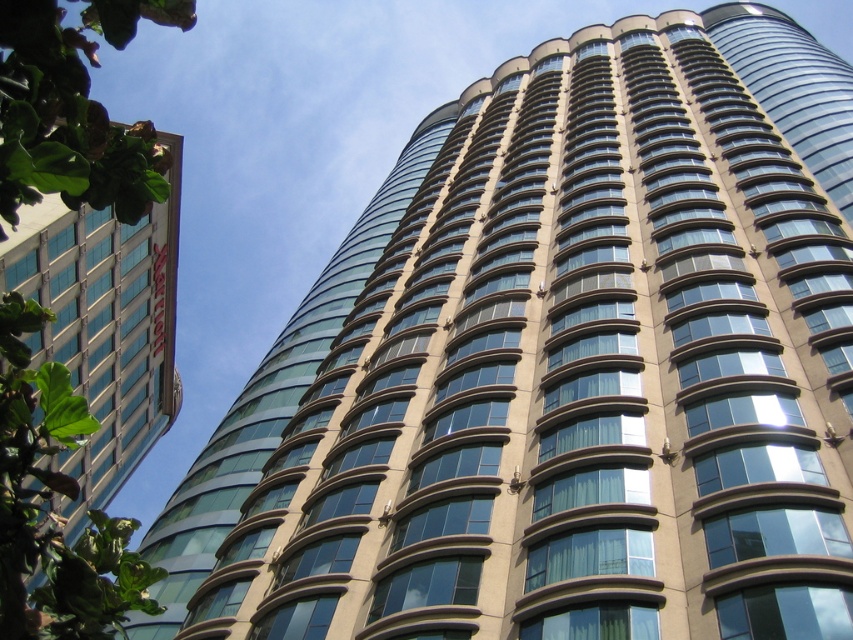
Looking at this image, which is more to the right, glassy blue windows at upper left or glassy tan tower at upper right?

glassy tan tower at upper right is more to the right.

Does glassy blue windows at upper left have a greater height compared to glassy tan tower at upper right?

Incorrect, glassy blue windows at upper left's height is not larger of glassy tan tower at upper right's.

Based on the photo, who is more distant from viewer, (91, 385) or (850, 115)?

The point (850, 115) is more distant.

Find the location of a particular element. The image size is (853, 640). glassy blue windows at upper left is located at coordinates (103, 326).